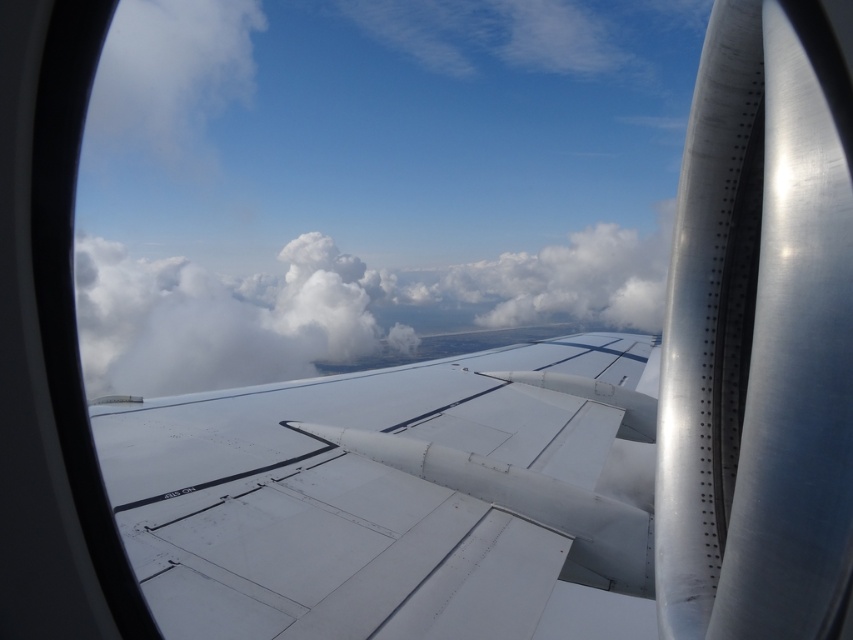
Does white matte wing at center have a greater width compared to white fluffy cloud at center?

In fact, white matte wing at center might be narrower than white fluffy cloud at center.

In the scene shown: Does white matte wing at center come behind white fluffy cloud at center?

Yes, white matte wing at center is behind white fluffy cloud at center.

Who is more distant from viewer, (193, 472) or (325, 289)?

Point (325, 289)

The height and width of the screenshot is (640, 853). Identify the location of white matte wing at center. (393, 499).